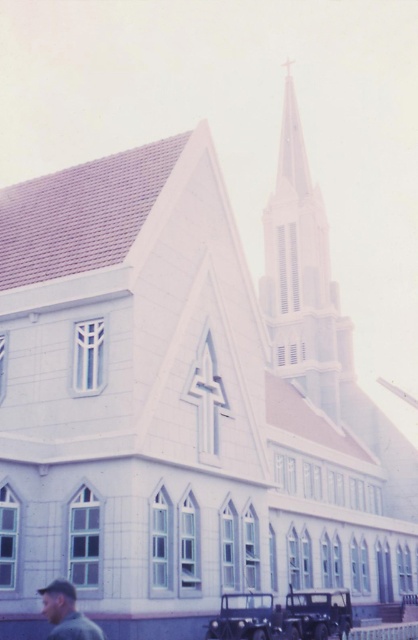
You are a photographer standing at the entrance of the church. You want to capture a photo that includes both the white stonework spire at upper center and the matte gray shirt at lower left. Which object should you position closer to the edge of the frame to ensure both fit in the shot?

Since the white stonework spire at upper center is wider than the matte gray shirt at lower left, you should position the matte gray shirt at lower left closer to the edge of the frame to ensure both fit in the shot.

You are standing in front of the church and want to take a photo that includes both the white stonework spire at upper center and the matte gray shirt at lower left. Which object should you focus on first to ensure both are in frame?

Answer: You should focus on the white stonework spire at upper center first because it is taller than the matte gray shirt at lower left, so adjusting the camera angle to include its full height will naturally include the shorter matte gray shirt at lower left in the frame.